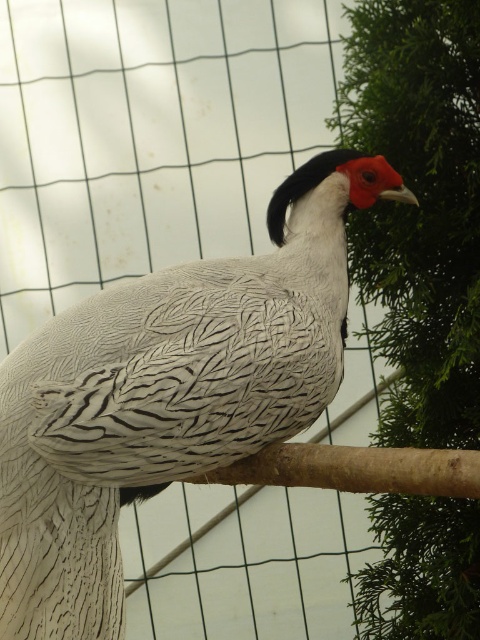
Describe the element at coordinates (168, 394) in the screenshot. I see `white feathered bird at center` at that location.

The image size is (480, 640). Find the location of `white feathered bird at center`. white feathered bird at center is located at coordinates (168, 394).